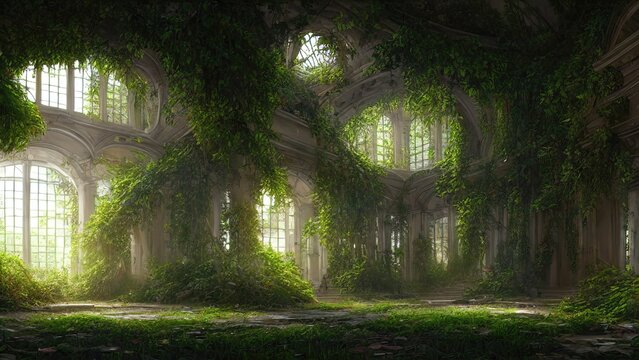
Locate an element on the screen. This screenshot has height=360, width=639. bottom level windows is located at coordinates (17, 218), (100, 186), (271, 225), (226, 234), (395, 241), (441, 240).